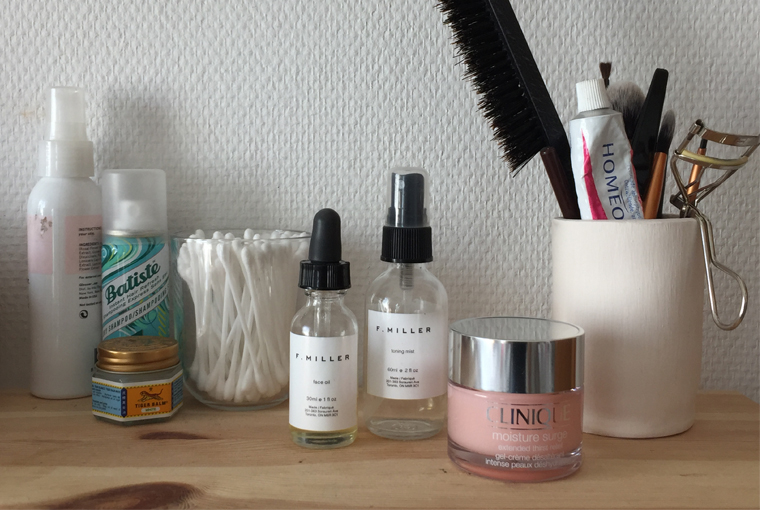
I want to click on wooden table top, so click(223, 480).